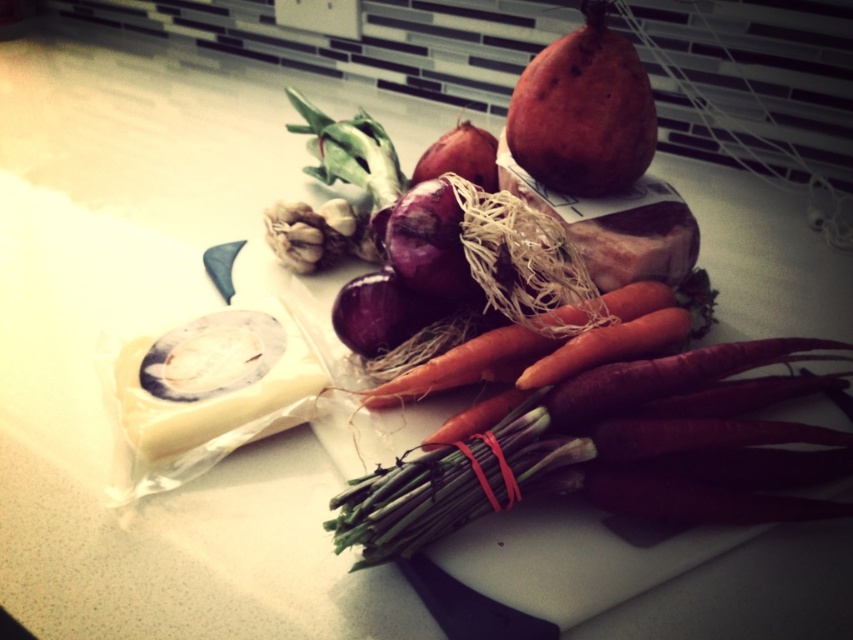
Between smooth brown potato at upper center and white matte garlic at center, which one has less height?

Standing shorter between the two is white matte garlic at center.

Does smooth brown potato at upper center appear under white matte garlic at center?

Incorrect, smooth brown potato at upper center is not positioned below white matte garlic at center.

Between point (605, 156) and point (341, 211), which one is positioned in front?

Point (605, 156) is in front.

Where is `smooth brown potato at upper center`? This screenshot has width=853, height=640. smooth brown potato at upper center is located at coordinates (583, 112).

Between smooth orange carrot at center and shiny purple onion at center, which one has less height?

shiny purple onion at center

Between point (403, 394) and point (376, 342), which one is positioned in front?

Positioned in front is point (403, 394).

Locate an element on the screen. This screenshot has width=853, height=640. smooth orange carrot at center is located at coordinates (459, 364).

Where is `smooth orange carrot at center`? This screenshot has height=640, width=853. smooth orange carrot at center is located at coordinates (459, 364).

Based on the photo, is smooth brown potato at upper center below purple matte onion at center?

No.

Which is below, smooth brown potato at upper center or purple matte onion at center?

purple matte onion at center is below.

Who is more distant from viewer, (585,76) or (389,252)?

Positioned behind is point (585,76).

At what (x,y) coordinates should I click in order to perform the action: click on smooth brown potato at upper center. Please return your answer as a coordinate pair (x, y). This screenshot has width=853, height=640. Looking at the image, I should click on (583, 112).